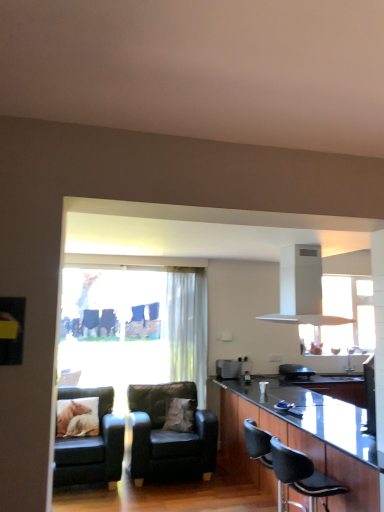
Question: Is black leather chair at lower right, which is counted as the 1th chair, starting from the front, shorter than leather couch at lower left, which ranks as the 2th chair in back-to-front order?

Choices:
 (A) yes
 (B) no

Answer: (A)

Question: Considering the relative positions of black leather chair at lower right, which is counted as the 1th chair, starting from the right, and leather couch at lower left, acting as the 3th chair starting from the right, in the image provided, is black leather chair at lower right, which is counted as the 1th chair, starting from the right, behind leather couch at lower left, acting as the 3th chair starting from the right,?

Choices:
 (A) yes
 (B) no

Answer: (B)

Question: Are black leather chair at lower right, the 3th chair positioned from the back, and leather couch at lower left, which ranks as the 2th chair in back-to-front order, beside each other?

Choices:
 (A) yes
 (B) no

Answer: (B)

Question: From the image's perspective, does black leather chair at lower right, which is counted as the 1th chair, starting from the front, appear higher than leather couch at lower left, positioned as the first chair in left-to-right order?

Choices:
 (A) yes
 (B) no

Answer: (A)

Question: From the image's perspective, is black leather chair at lower right, the 3th chair from the left, under leather couch at lower left, positioned as the first chair in left-to-right order?

Choices:
 (A) yes
 (B) no

Answer: (B)

Question: From a real-world perspective, is black leather chair at lower right, which is counted as the 1th chair, starting from the front, over leather couch at lower left, which ranks as the 2th chair in back-to-front order?

Choices:
 (A) yes
 (B) no

Answer: (A)

Question: Can you confirm if black leather chair at lower right, which is counted as the 1th chair, starting from the front, is positioned to the left of translucent fabric curtain at center?

Choices:
 (A) yes
 (B) no

Answer: (B)

Question: Can you confirm if black leather chair at lower right, which is counted as the 1th chair, starting from the front, is bigger than translucent fabric curtain at center?

Choices:
 (A) no
 (B) yes

Answer: (A)

Question: From a real-world perspective, is black leather chair at lower right, the 3th chair from the left, physically above translucent fabric curtain at center?

Choices:
 (A) yes
 (B) no

Answer: (B)

Question: Is the position of black leather chair at lower right, which is counted as the 1th chair, starting from the front, more distant than that of translucent fabric curtain at center?

Choices:
 (A) yes
 (B) no

Answer: (B)

Question: From the image's perspective, is black leather chair at lower right, the 3th chair positioned from the back, on translucent fabric curtain at center?

Choices:
 (A) yes
 (B) no

Answer: (B)

Question: Does black leather chair at lower right, which is counted as the 1th chair, starting from the front, have a lesser width compared to translucent fabric curtain at center?

Choices:
 (A) no
 (B) yes

Answer: (A)

Question: Is white soft pillow at center, the 1th pillow in the right-to-left sequence, wider than translucent fabric curtain at center?

Choices:
 (A) yes
 (B) no

Answer: (A)